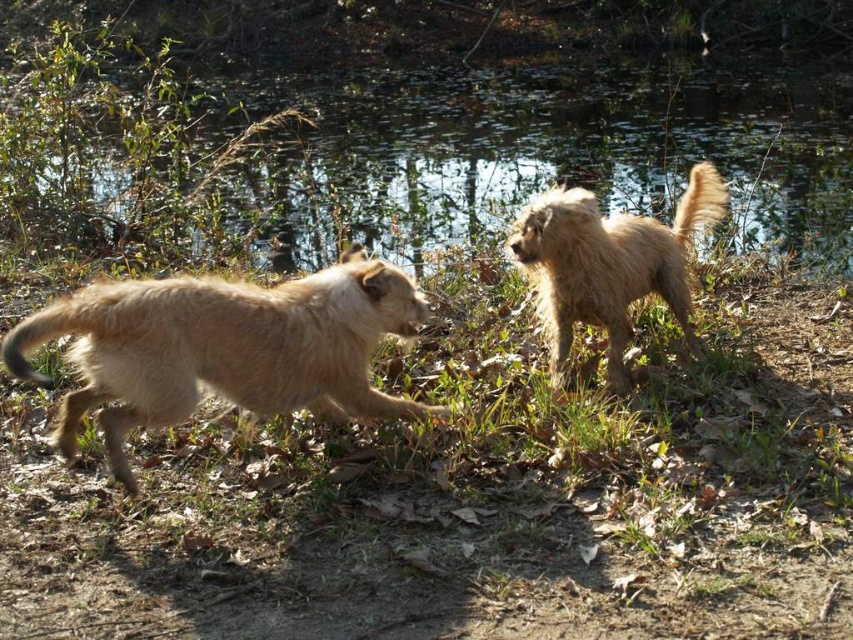
You are a photographer trying to capture a landscape shot of the green grass at upper center and the fuzzy beige dog at left. Since you want to include both in the frame, which object should you focus on first to ensure they are both in focus?

The green grass at upper center has a larger width than the fuzzy beige dog at left, so focusing on the green grass at upper center first would help ensure both are in focus as it covers more of the frame.

You are a photographer trying to capture a clear shot of the fuzzy brown dog at center. Since the green grass at center is in the way, can you determine if you need to adjust your camera angle upwards or downwards to avoid the grass?

The green grass at center has a greater height compared to the fuzzy brown dog at center, so you need to adjust your camera angle downwards to avoid the grass and focus on the dog.